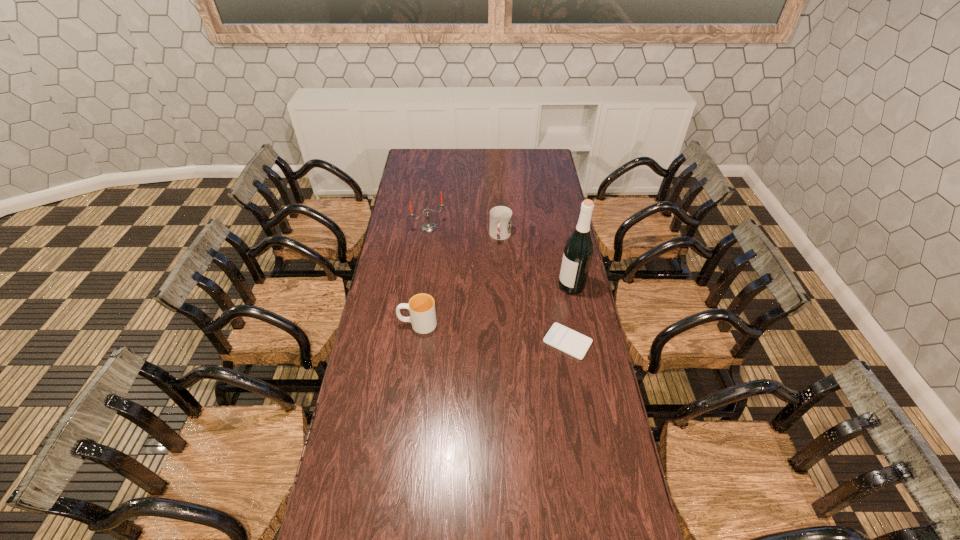
Image resolution: width=960 pixels, height=540 pixels. In order to click on blank space that satisfies the following two spatial constraints: 1. on the front side of the third farthest object; 2. on the left side of the fourth shortest object in this screenshot , I will do `click(421, 286)`.